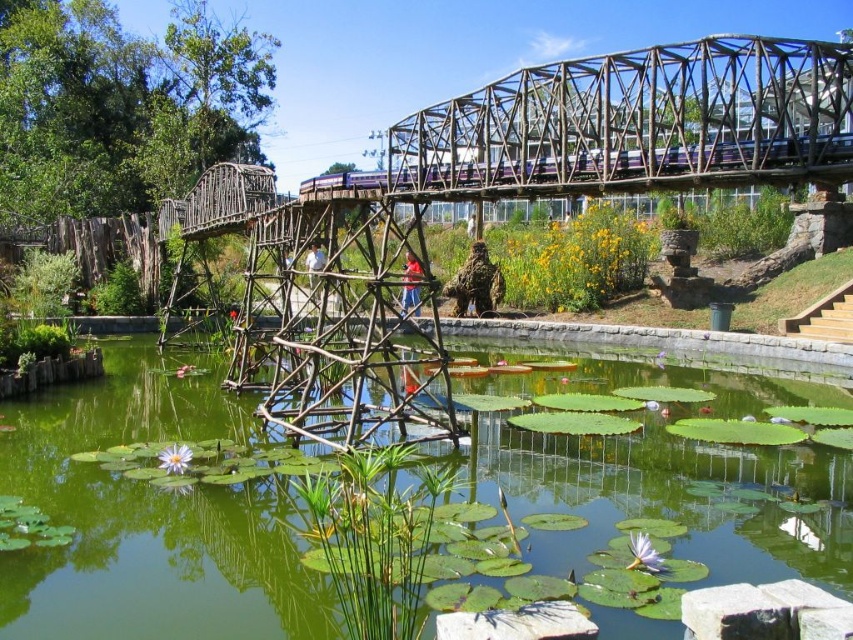
Which of these two, green lily pads at center or metallic structure at upper center, stands taller?

With more height is metallic structure at upper center.

What do you see at coordinates (148, 522) in the screenshot?
I see `green lily pads at center` at bounding box center [148, 522].

Is point (828, 586) farther from viewer compared to point (386, 372)?

No, it is not.

Where is `green lily pads at center`? This screenshot has height=640, width=853. green lily pads at center is located at coordinates (148, 522).